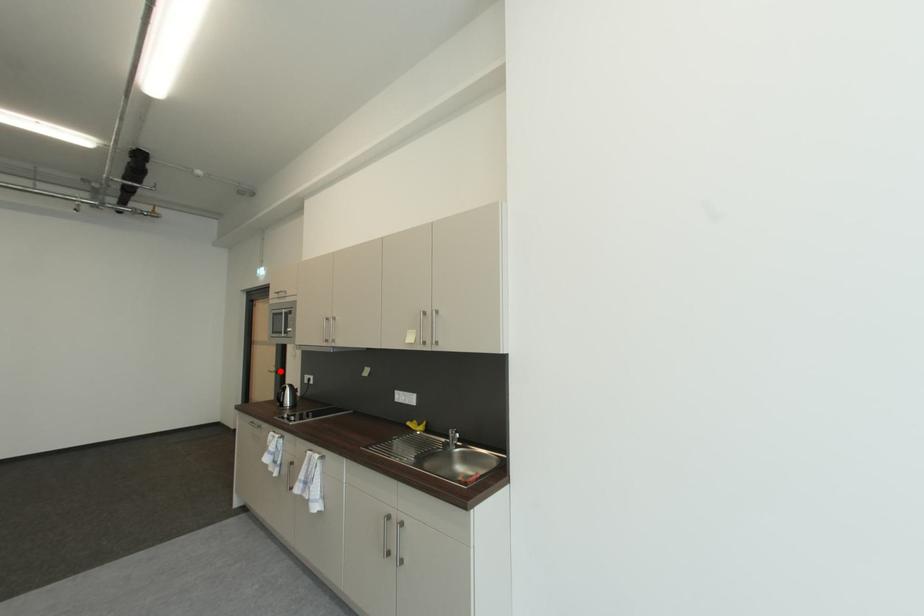
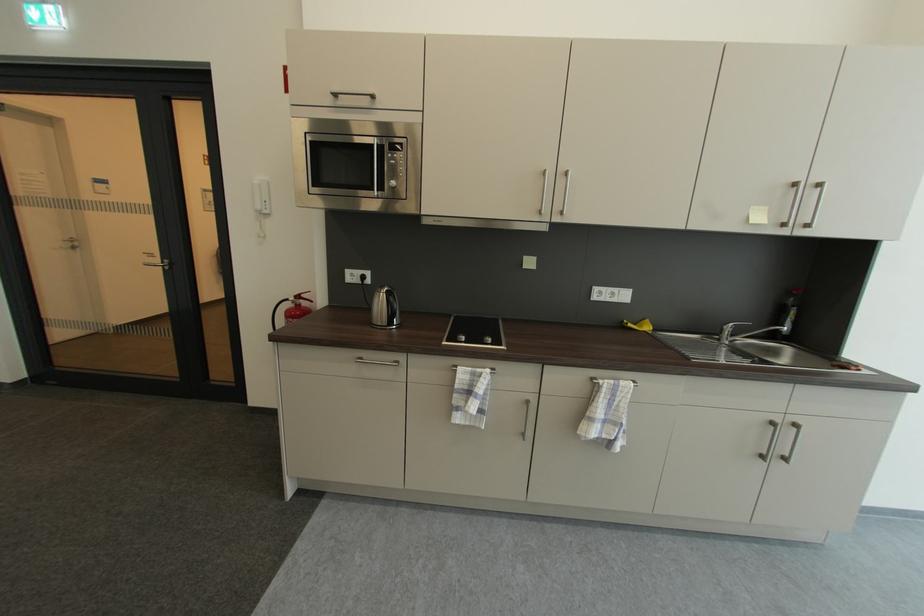
Question: I am providing you with two images of the same scene from different viewpoints. Given a red point in image1, look at the same physical point in image2. Is it:

Choices:
 (A) Closer to the viewpoint
 (B) Farther from the viewpoint

Answer: (A)